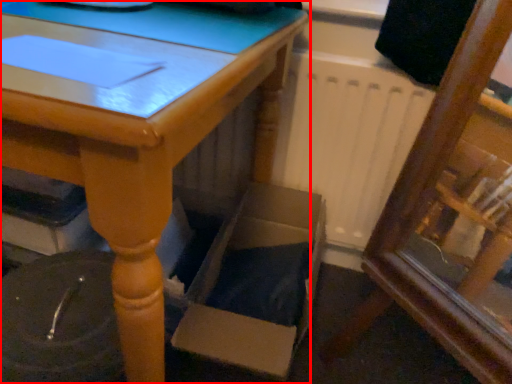
Question: From the image's perspective, where is table (annotated by the red box) located in relation to cardboard box in the image?

Choices:
 (A) above
 (B) below

Answer: (A)